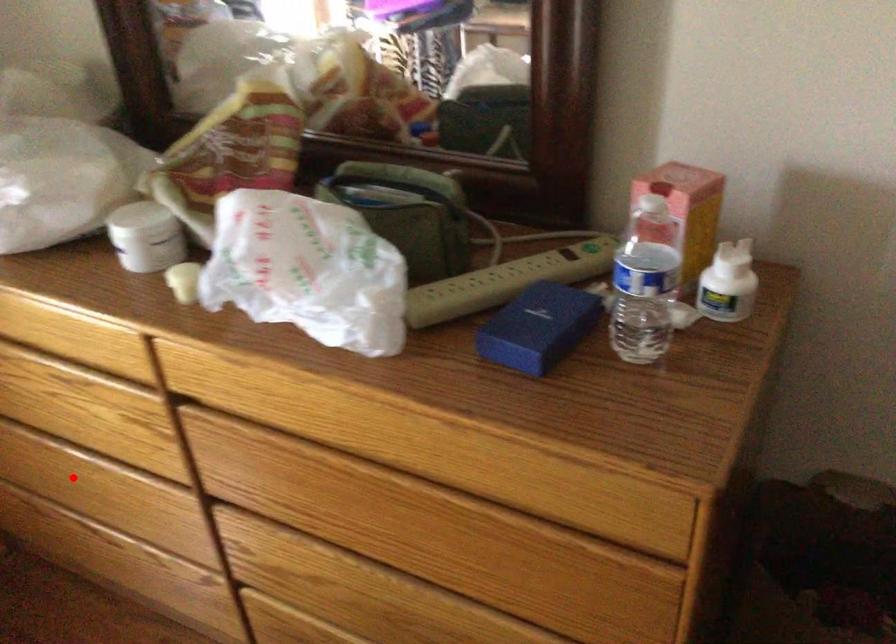
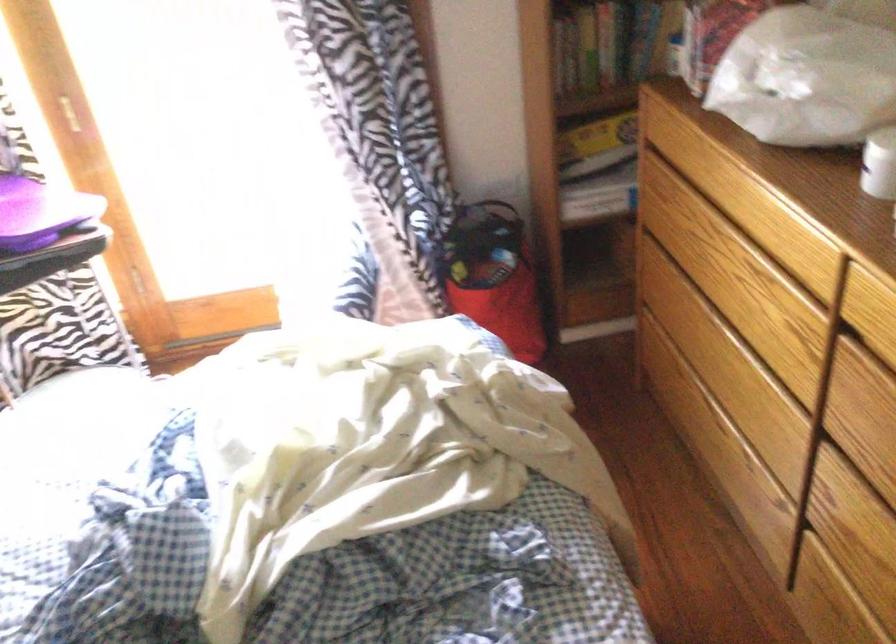
Where in the second image is the point corresponding to the highlighted location from the first image?

(719, 355)